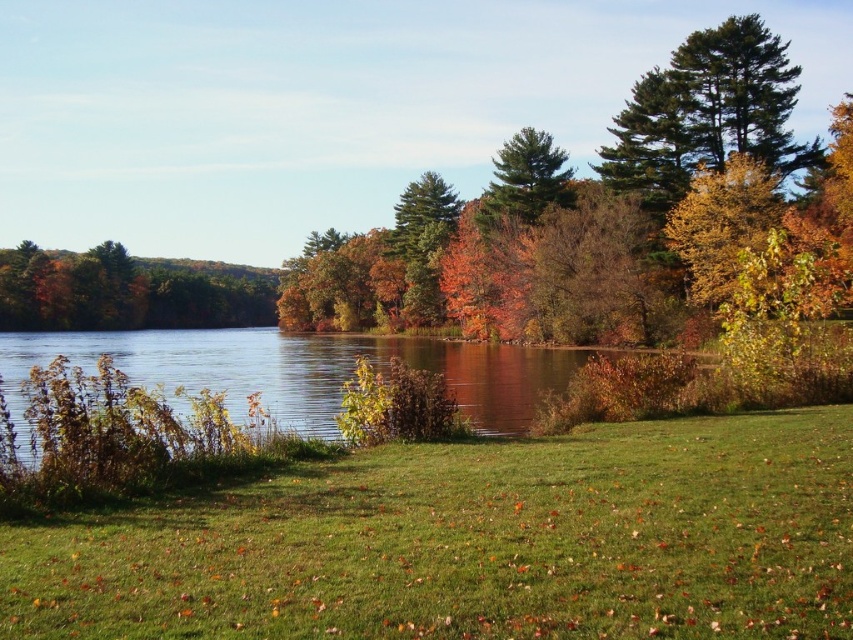
Question: Can you confirm if green grassy lake at center is positioned to the left of green matte tree at left?

Choices:
 (A) yes
 (B) no

Answer: (B)

Question: Is green leafy tree at upper right bigger than green grassy lake at center?

Choices:
 (A) no
 (B) yes

Answer: (B)

Question: Which object is the farthest from the green grassy lake at center?

Choices:
 (A) green leafy tree at upper right
 (B) green grassy at lower center
 (C) green matte tree at center

Answer: (B)

Question: Considering the relative positions of green leafy tree at upper right and green grassy lake at center in the image provided, where is green leafy tree at upper right located with respect to green grassy lake at center?

Choices:
 (A) above
 (B) below

Answer: (A)

Question: Among these objects, which one is farthest from the camera?

Choices:
 (A) green grassy at lower center
 (B) green matte tree at left

Answer: (B)

Question: Which object is the closest to the green matte tree at left?

Choices:
 (A) green grassy lake at center
 (B) green grassy at lower center

Answer: (A)